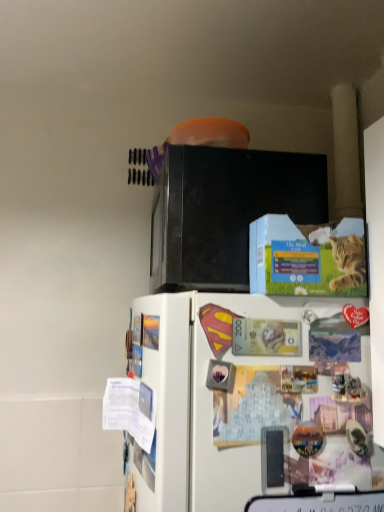
Question: Does blue cardboard box at upper center lie behind black matte microwave oven at upper center?

Choices:
 (A) yes
 (B) no

Answer: (B)

Question: Considering the relative positions of blue cardboard box at upper center and black matte microwave oven at upper center in the image provided, is blue cardboard box at upper center in front of black matte microwave oven at upper center?

Choices:
 (A) yes
 (B) no

Answer: (A)

Question: Does blue cardboard box at upper center have a lesser width compared to black matte microwave oven at upper center?

Choices:
 (A) yes
 (B) no

Answer: (A)

Question: Could you tell me if blue cardboard box at upper center is facing black matte microwave oven at upper center?

Choices:
 (A) no
 (B) yes

Answer: (A)

Question: Is blue cardboard box at upper center to the left of black matte microwave oven at upper center from the viewer's perspective?

Choices:
 (A) no
 (B) yes

Answer: (A)

Question: Does blue cardboard box at upper center have a greater height compared to black matte microwave oven at upper center?

Choices:
 (A) no
 (B) yes

Answer: (A)

Question: Is black matte microwave oven at upper center turned away from blue cardboard box at upper center?

Choices:
 (A) yes
 (B) no

Answer: (B)

Question: Considering the relative positions of black matte microwave oven at upper center and blue cardboard box at upper center in the image provided, is black matte microwave oven at upper center to the right of blue cardboard box at upper center from the viewer's perspective?

Choices:
 (A) yes
 (B) no

Answer: (B)

Question: Is black matte microwave oven at upper center positioned behind blue cardboard box at upper center?

Choices:
 (A) yes
 (B) no

Answer: (A)

Question: Does black matte microwave oven at upper center have a lesser width compared to blue cardboard box at upper center?

Choices:
 (A) no
 (B) yes

Answer: (A)

Question: From the image's perspective, would you say black matte microwave oven at upper center is shown under blue cardboard box at upper center?

Choices:
 (A) yes
 (B) no

Answer: (B)

Question: Considering the relative sizes of black matte microwave oven at upper center and blue cardboard box at upper center in the image provided, is black matte microwave oven at upper center wider than blue cardboard box at upper center?

Choices:
 (A) yes
 (B) no

Answer: (A)

Question: From a real-world perspective, is white matte refrigerator at lower center located beneath blue cardboard box at upper center?

Choices:
 (A) no
 (B) yes

Answer: (B)